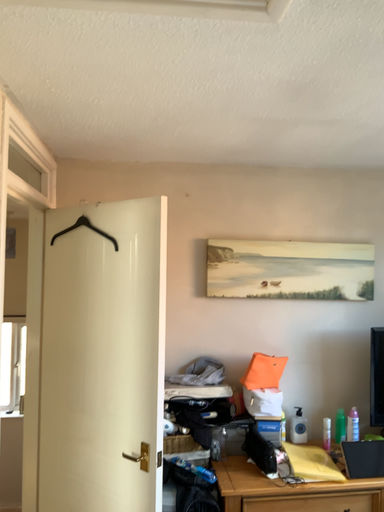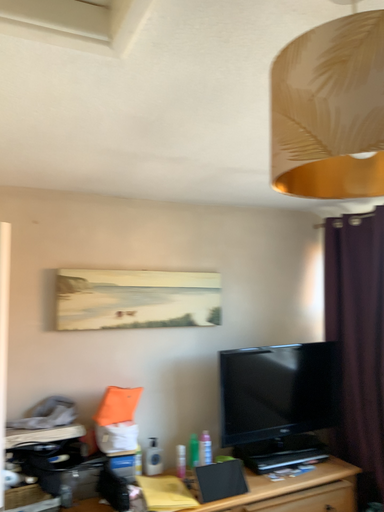
Question: How did the camera likely rotate when shooting the video?

Choices:
 (A) rotated right
 (B) rotated left

Answer: (A)